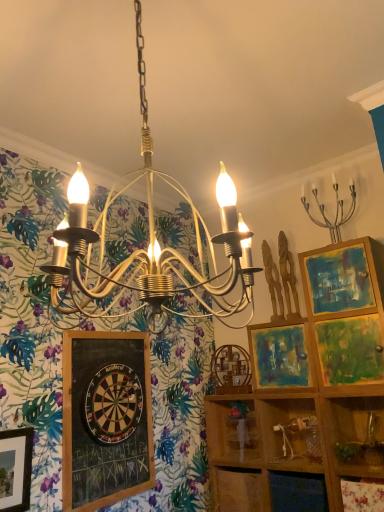
Question: Is point (359, 468) positioned closer to the camera than point (289, 415)?

Choices:
 (A) closer
 (B) farther

Answer: (A)

Question: Is wooden shelf at lower right in front of or behind wooden at center in the image?

Choices:
 (A) behind
 (B) front

Answer: (B)

Question: Estimate the real-world distances between objects in this image. Which object is farther from the wooden at center?

Choices:
 (A) wooden cabinet at lower center, which is the 1th cabinet from left to right
 (B) matte wooden picture frame at center right
 (C) wooden dartboard at center
 (D) clear plastic bottle at lower right, the 1th cabinet positioned from the right
 (E) metallic chandelier at center

Answer: (E)

Question: Which object is the closest to the clear plastic bottle at lower right, the second cabinet viewed from the left?

Choices:
 (A) silver metallic candelabra at upper right
 (B) metallic chandelier at center
 (C) wooden cabinet at lower center, the second cabinet positioned from the right
 (D) wooden dartboard at center
 (E) black chalkboard at lower left

Answer: (C)